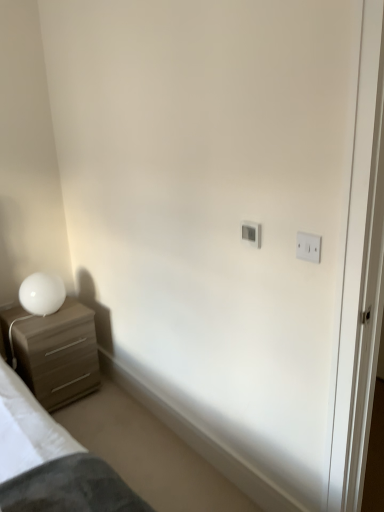
Find the location of `vacant point to the right of white glossy table lamp at lower left`. vacant point to the right of white glossy table lamp at lower left is located at coordinates (71, 312).